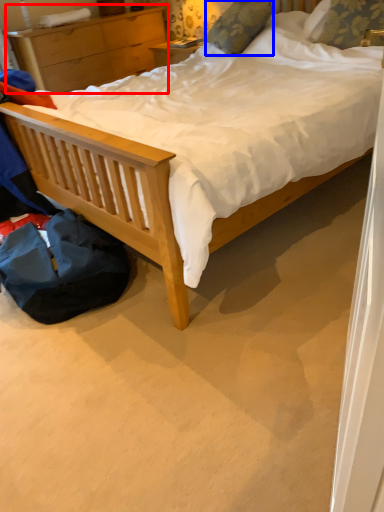
Question: Which point is closer to the camera, nightstand (highlighted by a red box) or pillow (highlighted by a blue box)?

Choices:
 (A) nightstand
 (B) pillow

Answer: (B)